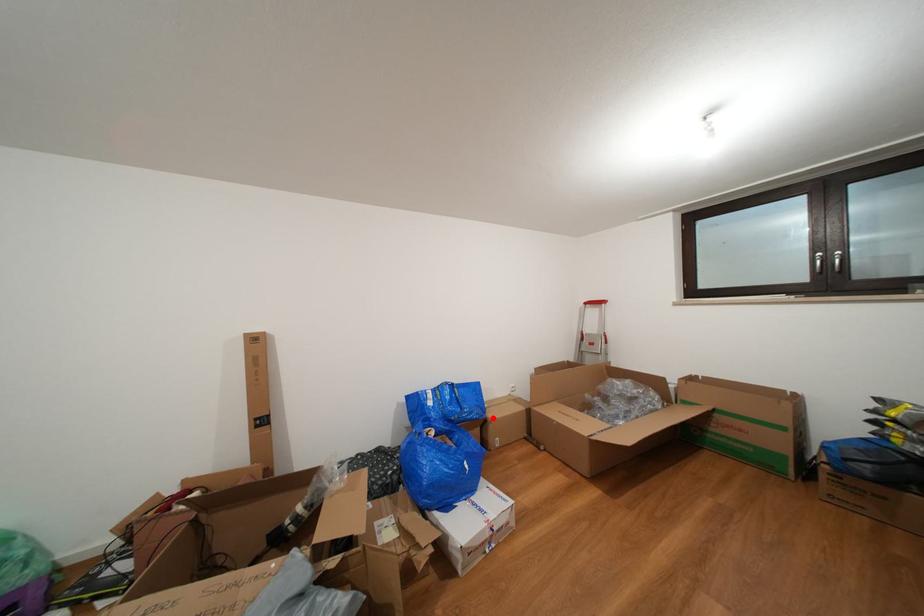
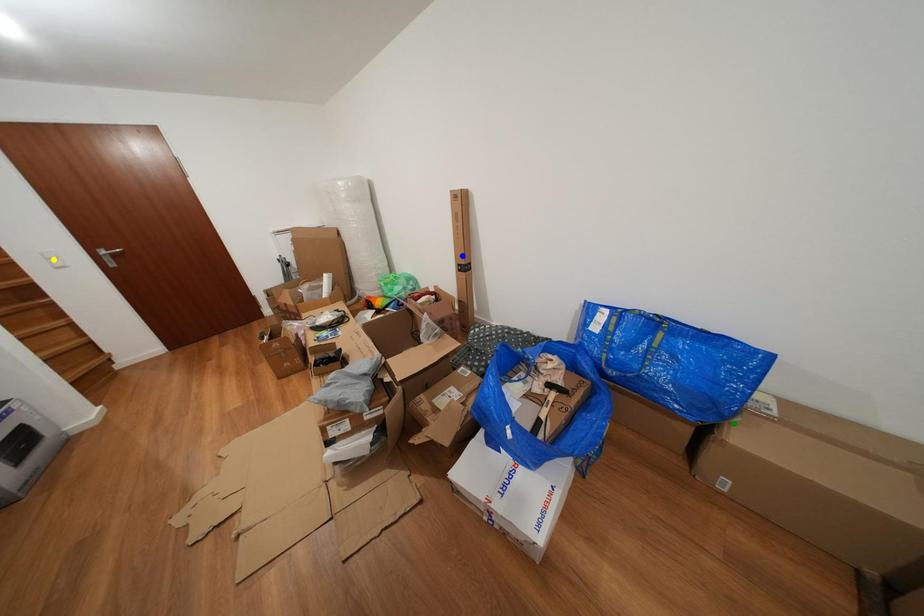
Question: I am providing you with two images of the same scene from different viewpoints. A red point is marked on the first image. You are given multiple points on the second image. In image 2, which mark is for the same physical point as the one in image 1?

Choices:
 (A) yellow point
 (B) blue point
 (C) green point

Answer: (C)